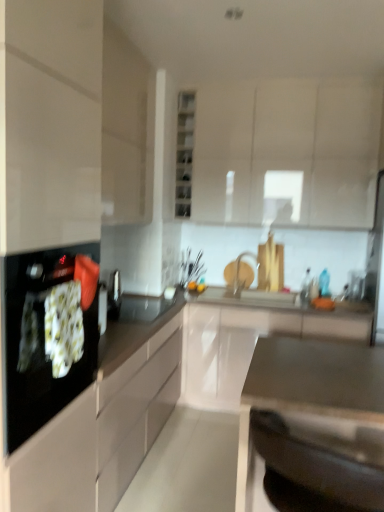
Measure the distance between point (324, 326) and camera.

Point (324, 326) is 10.25 feet from camera.

Measure the distance between black glossy countertop at center, placed as the second countertop when sorted from front to back, and camera.

The depth of black glossy countertop at center, placed as the second countertop when sorted from front to back, is 3.97 feet.

Describe the element at coordinates (46, 335) in the screenshot. This screenshot has width=384, height=512. I see `black glass cooktop at left` at that location.

Measure the distance between point (136,81) and camera.

Point (136,81) and camera are 2.73 meters apart.

Find the location of a particular element. Image resolution: width=384 pixels, height=512 pixels. white glossy cabinet at upper center, the first cabinetry from the top is located at coordinates (288, 149).

What's the angular difference between matte white cabinet at upper left, the second cabinetry in the bottom-to-top sequence, and white glossy cabinet at upper center, which is the 3th cabinetry in bottom-to-top order,'s facing directions?

They differ by 90 degrees in their facing directions.

Who is more distant, matte white cabinet at upper left, the second cabinetry in the bottom-to-top sequence, or white glossy cabinet at upper center, the first cabinetry from the top?

white glossy cabinet at upper center, the first cabinetry from the top, is behind.

From the picture: Is matte white cabinet at upper left, which is the 2th cabinetry in top-to-bottom order, taller than white glossy cabinet at upper center, the first cabinetry from the top?

Yes, matte white cabinet at upper left, which is the 2th cabinetry in top-to-bottom order, is taller than white glossy cabinet at upper center, the first cabinetry from the top.

Considering the sizes of objects matte white cabinet at upper left, which is the 2th cabinetry in top-to-bottom order, and white glossy cabinet at upper center, which is the 3th cabinetry in bottom-to-top order, in the image provided, who is smaller, matte white cabinet at upper left, which is the 2th cabinetry in top-to-bottom order, or white glossy cabinet at upper center, which is the 3th cabinetry in bottom-to-top order,?

Smaller between the two is matte white cabinet at upper left, which is the 2th cabinetry in top-to-bottom order.

Is white glossy cabinet at center, placed as the third cabinetry when sorted from top to bottom, touching matte white cabinet at upper left, which is the 2th cabinetry in top-to-bottom order?

white glossy cabinet at center, placed as the third cabinetry when sorted from top to bottom, and matte white cabinet at upper left, which is the 2th cabinetry in top-to-bottom order, are clearly separated.

In the image, is white glossy cabinet at center, placed as the third cabinetry when sorted from top to bottom, on the left side or the right side of matte white cabinet at upper left, which is the 2th cabinetry in top-to-bottom order?

In the image, white glossy cabinet at center, placed as the third cabinetry when sorted from top to bottom, appears on the right side of matte white cabinet at upper left, which is the 2th cabinetry in top-to-bottom order.

Is white glossy cabinet at center, the 1th cabinetry positioned from the bottom, oriented towards matte white cabinet at upper left, the second cabinetry in the bottom-to-top sequence?

No, white glossy cabinet at center, the 1th cabinetry positioned from the bottom, is not turned towards matte white cabinet at upper left, the second cabinetry in the bottom-to-top sequence.

Considering the relative sizes of white glossy cabinet at center, the 1th cabinetry positioned from the bottom, and matte white cabinet at upper left, which is the 2th cabinetry in top-to-bottom order, in the image provided, is white glossy cabinet at center, the 1th cabinetry positioned from the bottom, smaller than matte white cabinet at upper left, which is the 2th cabinetry in top-to-bottom order,?

No.

Is black glossy countertop at center, positioned as the first countertop in back-to-front order, situated inside white glossy cabinet at center, the 1th cabinetry positioned from the bottom, or outside?

black glossy countertop at center, positioned as the first countertop in back-to-front order, exists outside the volume of white glossy cabinet at center, the 1th cabinetry positioned from the bottom.

Is black glossy countertop at center, positioned as the first countertop in back-to-front order, oriented towards white glossy cabinet at center, placed as the third cabinetry when sorted from top to bottom?

No, black glossy countertop at center, positioned as the first countertop in back-to-front order, is not facing towards white glossy cabinet at center, placed as the third cabinetry when sorted from top to bottom.

Based on the photo, considering the sizes of objects black glossy countertop at center, positioned as the first countertop in back-to-front order, and white glossy cabinet at center, placed as the third cabinetry when sorted from top to bottom, in the image provided, who is wider, black glossy countertop at center, positioned as the first countertop in back-to-front order, or white glossy cabinet at center, placed as the third cabinetry when sorted from top to bottom,?

black glossy countertop at center, positioned as the first countertop in back-to-front order, is wider.

Does black glossy countertop at center, placed as the second countertop when sorted from front to back, have a smaller size compared to white glossy cabinet at center, the 1th cabinetry positioned from the bottom?

Incorrect, black glossy countertop at center, placed as the second countertop when sorted from front to back, is not smaller in size than white glossy cabinet at center, the 1th cabinetry positioned from the bottom.

Is black glass cooktop at left oriented away from black glossy countertop at center, positioned as the first countertop in back-to-front order?

No.

Is black glass cooktop at left outside of black glossy countertop at center, positioned as the first countertop in back-to-front order?

Yes, black glass cooktop at left is outside of black glossy countertop at center, positioned as the first countertop in back-to-front order.

Can you confirm if black glass cooktop at left is positioned to the right of black glossy countertop at center, placed as the second countertop when sorted from front to back?

Incorrect, black glass cooktop at left is not on the right side of black glossy countertop at center, placed as the second countertop when sorted from front to back.

Is black glass cooktop at left not near black glossy countertop at center, positioned as the first countertop in back-to-front order?

black glass cooktop at left is actually quite close to black glossy countertop at center, positioned as the first countertop in back-to-front order.

Find the location of a particular element. countertop that is the 1st one when counting downward from the black glass cooktop at left (from the image's perspective) is located at coordinates (143, 400).

Which of these two, black glossy countertop at center, positioned as the first countertop in back-to-front order, or black glass cooktop at left, is smaller?

black glass cooktop at left is smaller.

Considering the sizes of objects black glossy countertop at center, positioned as the first countertop in back-to-front order, and black glass cooktop at left in the image provided, who is shorter, black glossy countertop at center, positioned as the first countertop in back-to-front order, or black glass cooktop at left?

Standing shorter between the two is black glass cooktop at left.

Looking at this image, can you tell me how much white glossy cabinet at center, placed as the third cabinetry when sorted from top to bottom, and white glossy cabinet at upper center, the first cabinetry from the top, differ in facing direction?

The facing directions of white glossy cabinet at center, placed as the third cabinetry when sorted from top to bottom, and white glossy cabinet at upper center, the first cabinetry from the top, are 0.000274 degrees apart.

From a real-world perspective, does white glossy cabinet at center, placed as the third cabinetry when sorted from top to bottom, stand above white glossy cabinet at upper center, which is the 3th cabinetry in bottom-to-top order?

No.

Which point is more forward, (x=211, y=343) or (x=345, y=161)?

Positioned in front is point (x=345, y=161).

Can we say white glossy cabinet at center, placed as the third cabinetry when sorted from top to bottom, lies outside white glossy cabinet at upper center, which is the 3th cabinetry in bottom-to-top order?

white glossy cabinet at center, placed as the third cabinetry when sorted from top to bottom, is positioned outside white glossy cabinet at upper center, which is the 3th cabinetry in bottom-to-top order.

Between transparent glass shelves at center and black glossy countertop at center, placed as the second countertop when sorted from front to back, which one has larger size?

black glossy countertop at center, placed as the second countertop when sorted from front to back.

Is transparent glass shelves at center further to camera compared to black glossy countertop at center, positioned as the first countertop in back-to-front order?

Yes, transparent glass shelves at center is further from the viewer.

Is point (183, 111) closer to camera compared to point (229, 389)?

No, it is not.

Between transparent glass shelves at center and black glossy countertop at center, positioned as the first countertop in back-to-front order, which one appears on the right side from the viewer's perspective?

black glossy countertop at center, positioned as the first countertop in back-to-front order, is more to the right.

From the image's perspective, starting from the white glossy cabinet at upper center, the first cabinetry from the top, which cabinetry is the 1st one below? Please provide its 2D coordinates.

[(71, 125)]

Identify the location of cabinetry that is the 1st object located behind the matte white cabinet at upper left, which is the 2th cabinetry in top-to-bottom order. Image resolution: width=384 pixels, height=512 pixels. (244, 346).

When comparing their distances from transparent glass shelves at center, does black glass cooktop at left or white glossy cabinet at upper center, the first cabinetry from the top, seem closer?

white glossy cabinet at upper center, the first cabinetry from the top, lies closer to transparent glass shelves at center than the other object.

Based on their spatial positions, is white glossy cabinet at center, the 1th cabinetry positioned from the bottom, or black glossy countertop at center, placed as the second countertop when sorted from front to back, further from black glass cooktop at left?

The object further to black glass cooktop at left is white glossy cabinet at center, the 1th cabinetry positioned from the bottom.

Considering their positions, is transparent glass shelves at center positioned closer to black glossy countertop at center, placed as the second countertop when sorted from front to back, than white glossy cabinet at upper center, which is the 3th cabinetry in bottom-to-top order?

white glossy cabinet at upper center, which is the 3th cabinetry in bottom-to-top order.

Looking at the image, which one is located further to black glossy countertop at center, positioned as the first countertop in back-to-front order, transparent glass shelves at center or black glass cooktop at left?

transparent glass shelves at center.

Considering their positions, is black glossy countertop at center, positioned as the first countertop in back-to-front order, positioned closer to matte white cabinet at upper left, which is the 2th cabinetry in top-to-bottom order, than white glossy cabinet at center, placed as the third cabinetry when sorted from top to bottom?

Among the two, black glossy countertop at center, positioned as the first countertop in back-to-front order, is located nearer to matte white cabinet at upper left, which is the 2th cabinetry in top-to-bottom order.

Which object lies further to the anchor point white glossy cabinet at center, placed as the third cabinetry when sorted from top to bottom, black glossy countertop at center, placed as the second countertop when sorted from front to back, or white glossy cabinet at upper center, the first cabinetry from the top?

white glossy cabinet at upper center, the first cabinetry from the top.

Considering their positions, is white glossy cabinet at upper center, the first cabinetry from the top, positioned further to black glass cooktop at left than white glossy cabinet at center, placed as the third cabinetry when sorted from top to bottom?

white glossy cabinet at upper center, the first cabinetry from the top, is further to black glass cooktop at left.

Looking at the image, which one is located closer to transparent glass shelves at center, white glossy cabinet at center, the 1th cabinetry positioned from the bottom, or black glossy countertop at center, positioned as the first countertop in back-to-front order?

The object closer to transparent glass shelves at center is white glossy cabinet at center, the 1th cabinetry positioned from the bottom.

Where is `countertop between matte white cabinet at upper left, which is the 2th cabinetry in top-to-bottom order, and satin metallic sink at lower center, the first countertop in the front-to-back sequence, vertically`? The width and height of the screenshot is (384, 512). countertop between matte white cabinet at upper left, which is the 2th cabinetry in top-to-bottom order, and satin metallic sink at lower center, the first countertop in the front-to-back sequence, vertically is located at coordinates (143, 400).

Where is `countertop between white glossy cabinet at upper center, which is the 3th cabinetry in bottom-to-top order, and satin metallic sink at lower center, which is the second countertop from back to front, in the vertical direction`? Image resolution: width=384 pixels, height=512 pixels. countertop between white glossy cabinet at upper center, which is the 3th cabinetry in bottom-to-top order, and satin metallic sink at lower center, which is the second countertop from back to front, in the vertical direction is located at coordinates (143, 400).

Identify the location of glass door situated between matte white cabinet at upper left, the second cabinetry in the bottom-to-top sequence, and white glossy cabinet at upper center, the first cabinetry from the top, from left to right. The width and height of the screenshot is (384, 512). (184, 153).

In order to click on cabinetry between white glossy cabinet at upper center, which is the 3th cabinetry in bottom-to-top order, and white glossy cabinet at center, the 1th cabinetry positioned from the bottom, vertically in this screenshot , I will do `click(71, 125)`.